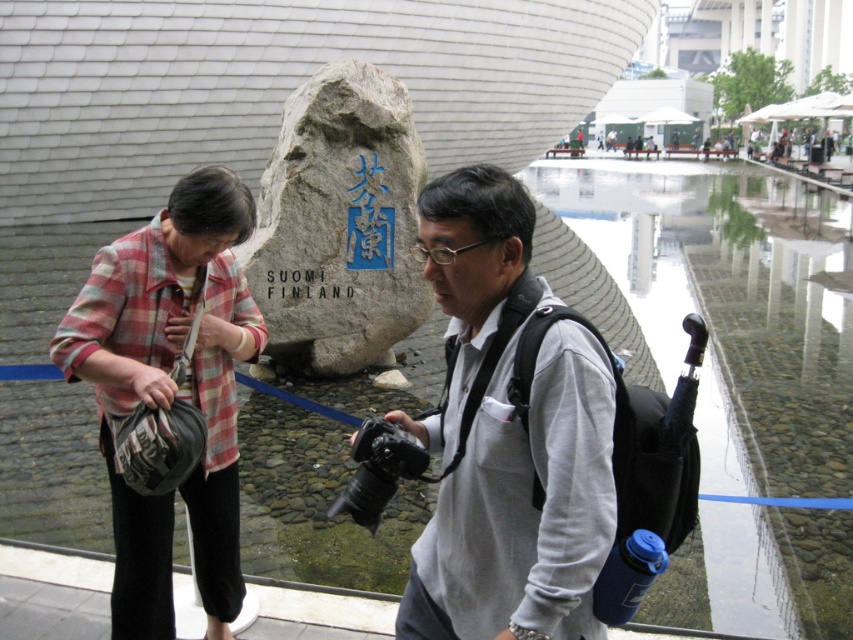
Question: Which object is the farthest from the gray fabric camera at center?

Choices:
 (A) plaid fabric jacket at left
 (B) gray stone monument at center

Answer: (B)

Question: Which of the following is the closest to the observer?

Choices:
 (A) gray fabric camera at center
 (B) gray stone monument at center
 (C) plaid fabric jacket at left

Answer: (A)

Question: Is plaid fabric jacket at left above gray stone monument at center?

Choices:
 (A) yes
 (B) no

Answer: (B)

Question: Can you confirm if gray fabric camera at center is positioned to the left of gray stone monument at center?

Choices:
 (A) no
 (B) yes

Answer: (A)

Question: Does gray fabric camera at center appear on the right side of plaid fabric jacket at left?

Choices:
 (A) no
 (B) yes

Answer: (B)

Question: Which of the following is the closest to the observer?

Choices:
 (A) (202, 490)
 (B) (495, 200)
 (C) (734, 326)

Answer: (B)